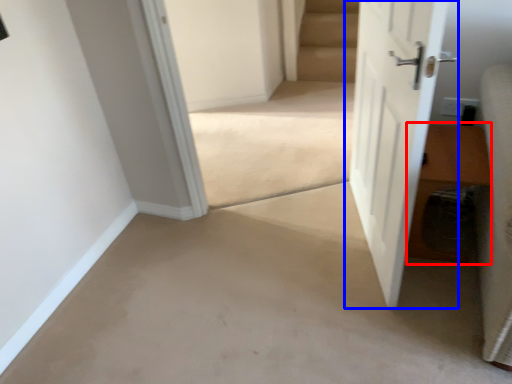
Question: Among these objects, which one is nearest to the camera, hardwood (highlighted by a red box) or door (highlighted by a blue box)?

Choices:
 (A) hardwood
 (B) door

Answer: (B)